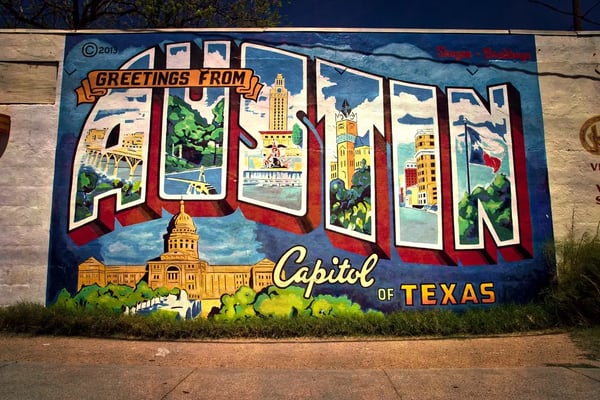
The width and height of the screenshot is (600, 400). Find the location of `dark gray background color`. dark gray background color is located at coordinates (307, 9).